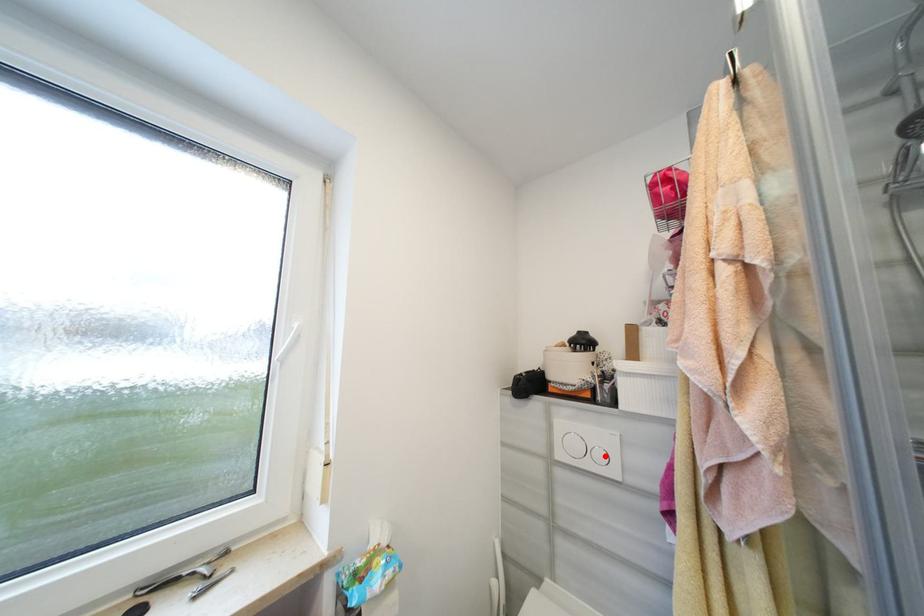
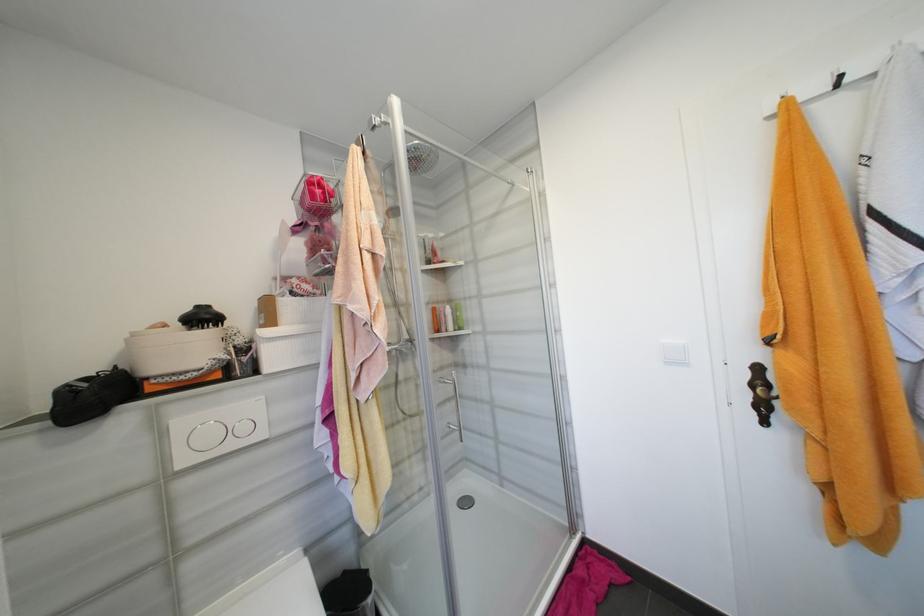
The point at the highlighted location is marked in the first image. Where is the corresponding point in the second image?

(249, 429)